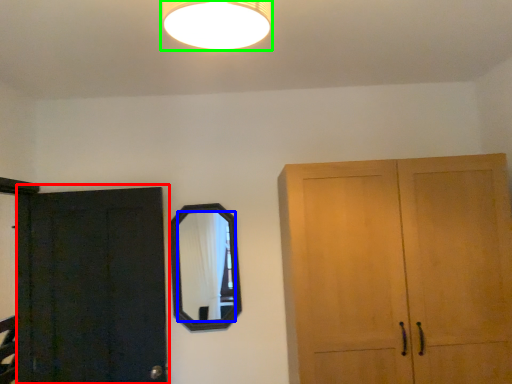
Question: Which object is the closest to the door (highlighted by a red box)? Choose among these: mirror (highlighted by a blue box) or lamp (highlighted by a green box).

Choices:
 (A) mirror
 (B) lamp

Answer: (A)